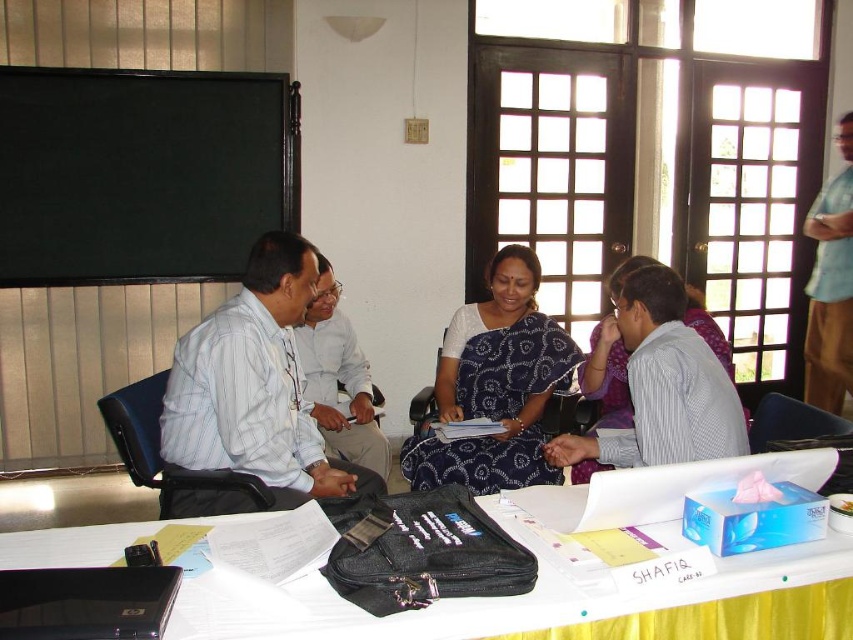
Question: Which point is farther from the camera taking this photo?

Choices:
 (A) (514, 404)
 (B) (624, 448)
 (C) (828, 580)

Answer: (A)

Question: Does black matte/blackboard at upper left have a lesser width compared to light blue shirt at upper right?

Choices:
 (A) yes
 (B) no

Answer: (B)

Question: Estimate the real-world distances between objects in this image. Which object is farther from the white striped shirt at center?

Choices:
 (A) light blue shirt at upper right
 (B) white striped shirt at left
 (C) blue printed sari at center
 (D) matte white shirt at center

Answer: (A)

Question: Which object is positioned closest to the black matte/blackboard at upper left?

Choices:
 (A) white striped shirt at center
 (B) light blue shirt at upper right
 (C) yellow fabric table at lower center
 (D) white striped shirt at left

Answer: (D)

Question: Does yellow fabric table at lower center appear under matte white shirt at center?

Choices:
 (A) no
 (B) yes

Answer: (B)

Question: Can you confirm if white striped shirt at center is thinner than matte white shirt at center?

Choices:
 (A) yes
 (B) no

Answer: (B)